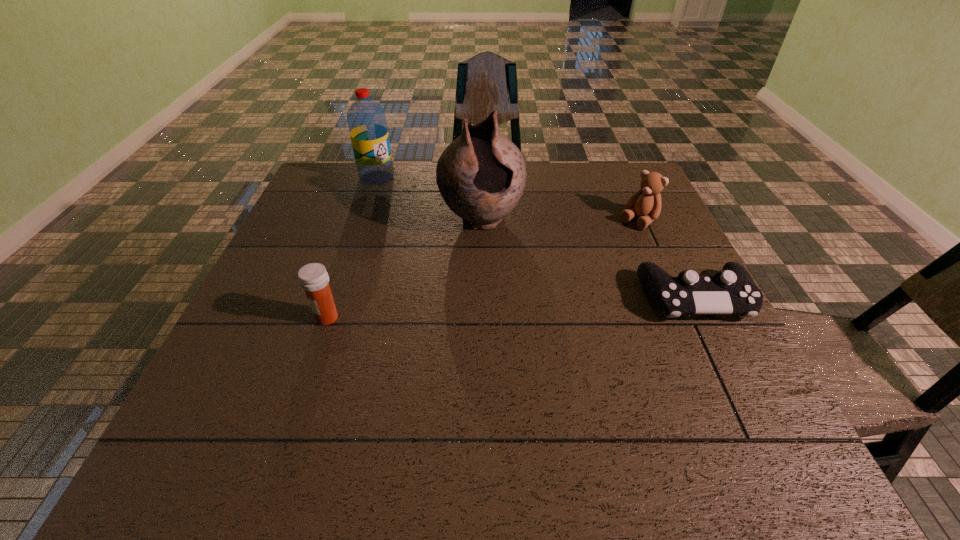
The width and height of the screenshot is (960, 540). I want to click on blank space at the far left corner of the desktop, so click(x=350, y=200).

Find the location of a particular element. This screenshot has height=540, width=960. blank area at the near left corner is located at coordinates (242, 395).

You are a GUI agent. You are given a task and a screenshot of the screen. Output one action in this format:
    pyautogui.click(x=<x>, y=<y>)
    Task: Click on the vacant space at the far right corner of the desktop
    The image size is (960, 540).
    Given the screenshot: What is the action you would take?
    pyautogui.click(x=613, y=167)

Locate an element on the screen. The width and height of the screenshot is (960, 540). free point between the water bottle and the third object from left to right is located at coordinates (429, 199).

Where is `blank region between the third object from right to left and the fourth shortest object`? Image resolution: width=960 pixels, height=540 pixels. blank region between the third object from right to left and the fourth shortest object is located at coordinates (429, 199).

Where is `free point between the third object from right to left and the farthest object`? This screenshot has height=540, width=960. free point between the third object from right to left and the farthest object is located at coordinates (429, 199).

Where is `unoccupied area between the farthest object and the shortest object`? The height and width of the screenshot is (540, 960). unoccupied area between the farthest object and the shortest object is located at coordinates (536, 238).

The width and height of the screenshot is (960, 540). What are the coordinates of `vacant space in between the teddy bear and the control` in the screenshot? It's located at (666, 259).

You are a GUI agent. You are given a task and a screenshot of the screen. Output one action in this format:
    pyautogui.click(x=<x>, y=<y>)
    Task: Click on the free spot between the medicine and the second tallest object
    
    Given the screenshot: What is the action you would take?
    coord(352,248)

Find the location of a particular element. free space between the farthest object and the shortest object is located at coordinates (536, 238).